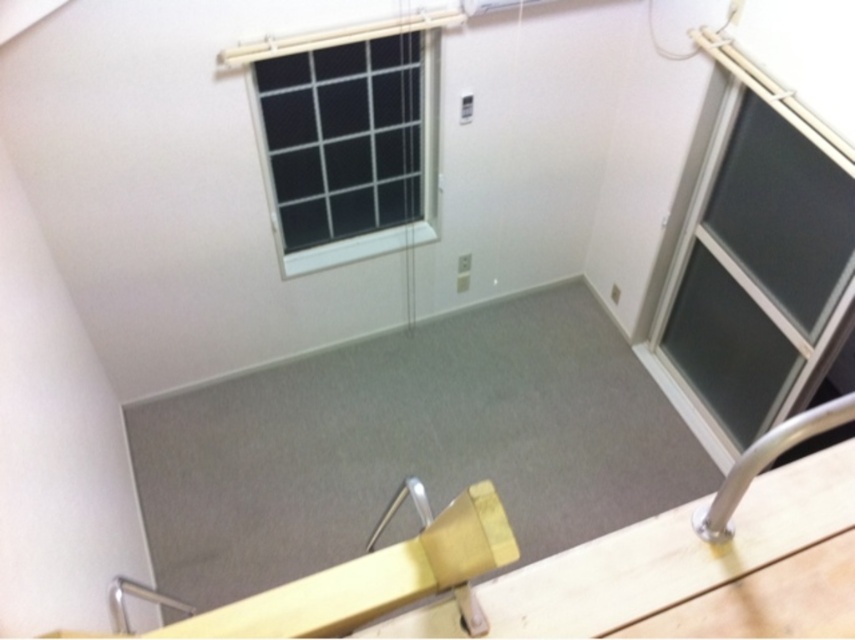
You are a delivery robot with a 2.44 meter long package. You need to navigate through the space between the dark gray glass door at right and the camera. Can your package fit through this space without bending or rotating it?

The space between the dark gray glass door at right and the camera is 2.44 meters, so the package can fit through the space as it is exactly the same length as the package.

You are a delivery person trying to deliver a tall package that is 2 meters in height. You need to enter the room through either the dark gray glass door at right or the black mesh window at upper center. Which entrance can accommodate your package without needing to tilt it vertically?

The dark gray glass door at right has a greater height compared to the black mesh window at upper center, so the dark gray glass door at right can accommodate the tall package without tilting it vertically.

You are standing in the center of the room and want to exit through the dark gray glass door at right. Based on the room layout, where should you walk towards to reach the door?

The dark gray glass door at right is located at point (758,260), so you should walk towards the right side of the room to reach the door.